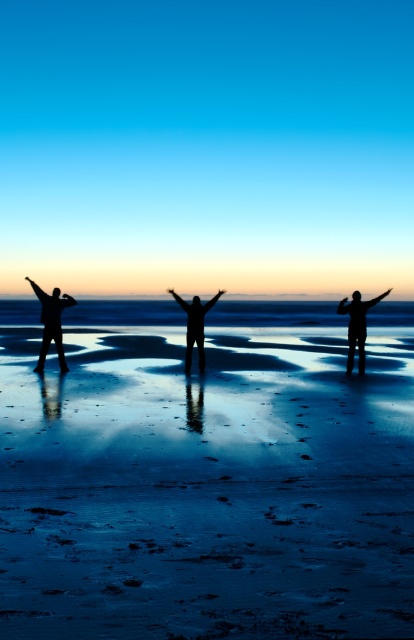
You are a photographer trying to capture the perfect shot of the beach scene. You notice two people in the frame, the silhouette figure at right and the black matte person at center. Which of these two people appears narrower in your photo?

The silhouette figure at right appears narrower than the black matte person at center in the photo.

You are standing on the beach and want to take a photo of both the silhouette figure at right and the black matte person at center without moving either of them. What is the minimum distance you need to move backward to ensure both are fully in frame?

The silhouette figure at right is 11.17 feet away from the black matte person at center. To capture both in the same frame without moving them, you need to move back at least half the distance between them, which would be approximately 5.585 feet. This ensures both are centered and within the camera view.